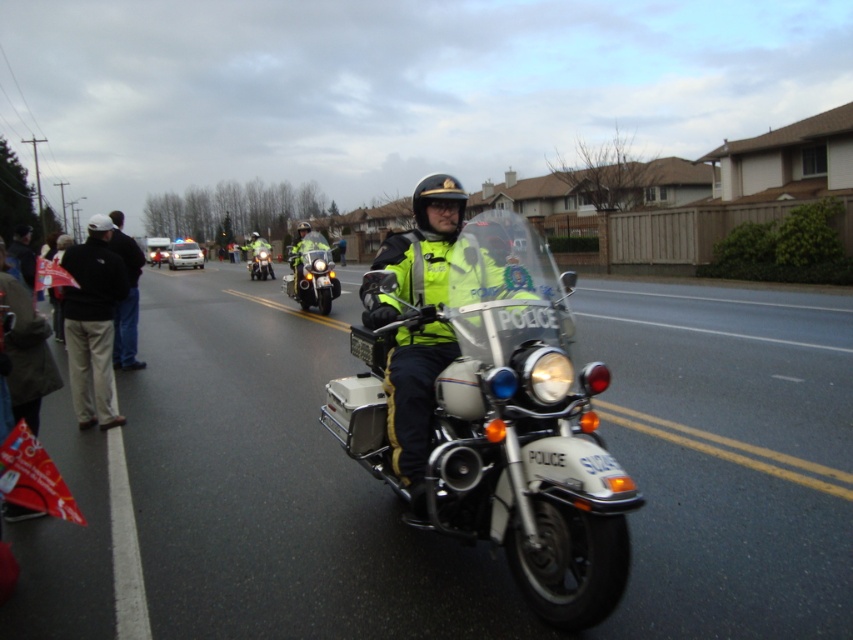
Question: Which object appears farthest from the camera in this image?

Choices:
 (A) shiny chrome motorcycle at center
 (B) black fabric jacket at left

Answer: (A)

Question: Which point appears closest to the camera in this image?

Choices:
 (A) (120, 321)
 (B) (262, 260)

Answer: (A)

Question: Based on their relative distances, which object is nearer to the reflective yellow vest at center?

Choices:
 (A) metallic silver motorcycle at center
 (B) shiny chrome motorcycle at center
 (C) white metallic police motorcycle at center
 (D) black fabric jacket at left

Answer: (C)

Question: Can you confirm if reflective yellow vest at center is positioned above metallic silver motorcycle at center?

Choices:
 (A) no
 (B) yes

Answer: (B)

Question: Does reflective yellow vest at center have a smaller size compared to shiny chrome motorcycle at center?

Choices:
 (A) no
 (B) yes

Answer: (B)

Question: Is reflective yellow vest at center below black fabric jacket at left?

Choices:
 (A) yes
 (B) no

Answer: (B)